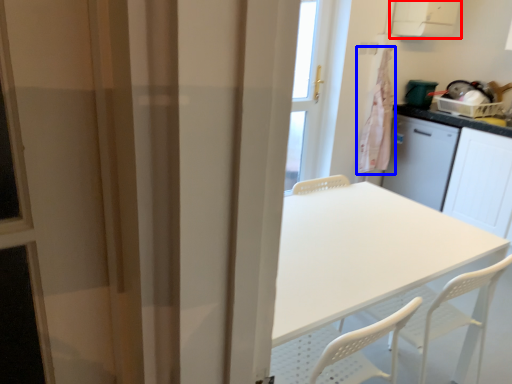
Question: Which point is further to the camera, exhaust hood (highlighted by a red box) or laundry (highlighted by a blue box)?

Choices:
 (A) exhaust hood
 (B) laundry

Answer: (B)